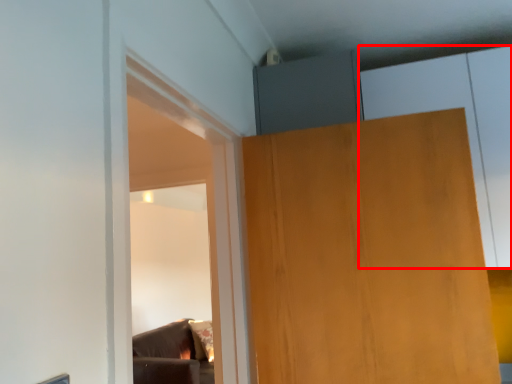
Question: Considering the relative positions of cabinetry (annotated by the red box) and door in the image provided, where is cabinetry (annotated by the red box) located with respect to the staircase?

Choices:
 (A) left
 (B) right

Answer: (B)